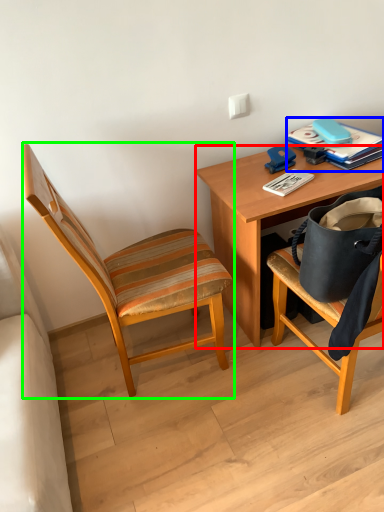
Question: Based on their relative distances, which object is farther from desk (highlighted by a red box)? Choose from paperback book (highlighted by a blue box) and chair (highlighted by a green box).

Choices:
 (A) paperback book
 (B) chair

Answer: (B)